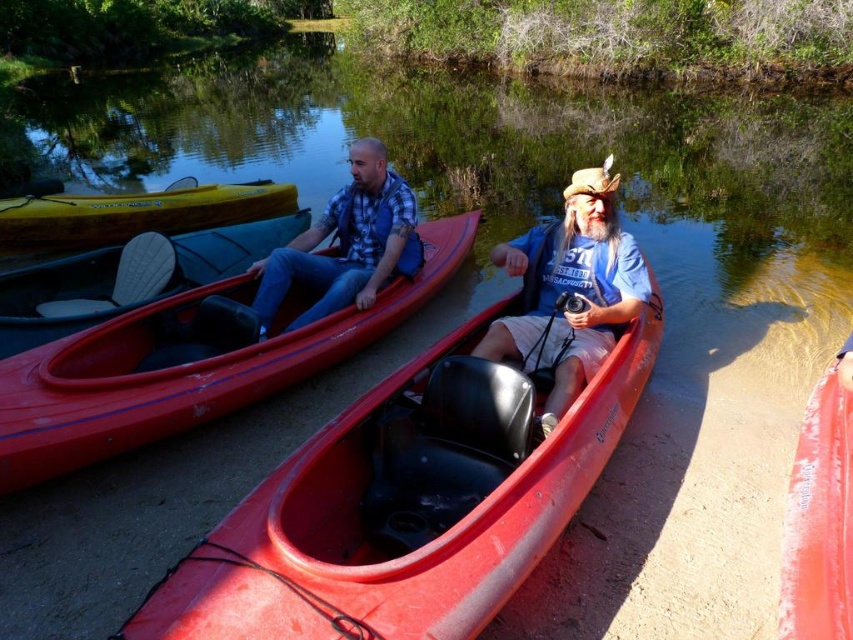
Question: Does matte black seat at left lie in front of matte blue vest at center?

Choices:
 (A) no
 (B) yes

Answer: (B)

Question: Is matte plastic canoe at center to the right of matte black paddle at left from the viewer's perspective?

Choices:
 (A) yes
 (B) no

Answer: (A)

Question: Among these objects, which one is farthest from the camera?

Choices:
 (A) matte blue vest at center
 (B) blue cotton shirt at center

Answer: (A)

Question: Which object is the closest to the matte black seat at left?

Choices:
 (A) matte black paddle at left
 (B) rubberized red canoe at center

Answer: (A)

Question: Which point is farther to the camera?

Choices:
 (A) (33, 368)
 (B) (201, 195)
 (C) (279, 250)

Answer: (B)

Question: From the image, what is the correct spatial relationship of blue cotton shirt at center in relation to yellow wood canoe at center?

Choices:
 (A) left
 (B) right

Answer: (B)